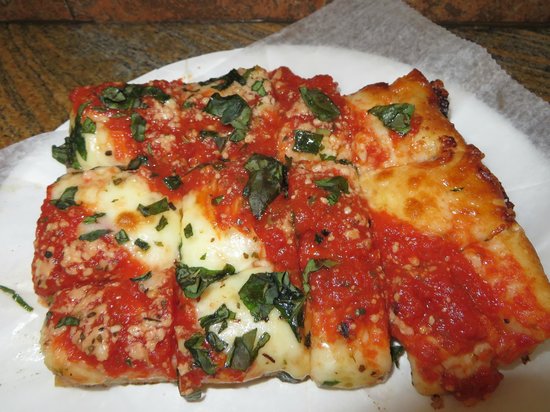
Identify the location of table. The width and height of the screenshot is (550, 412). (63, 77), (514, 56).